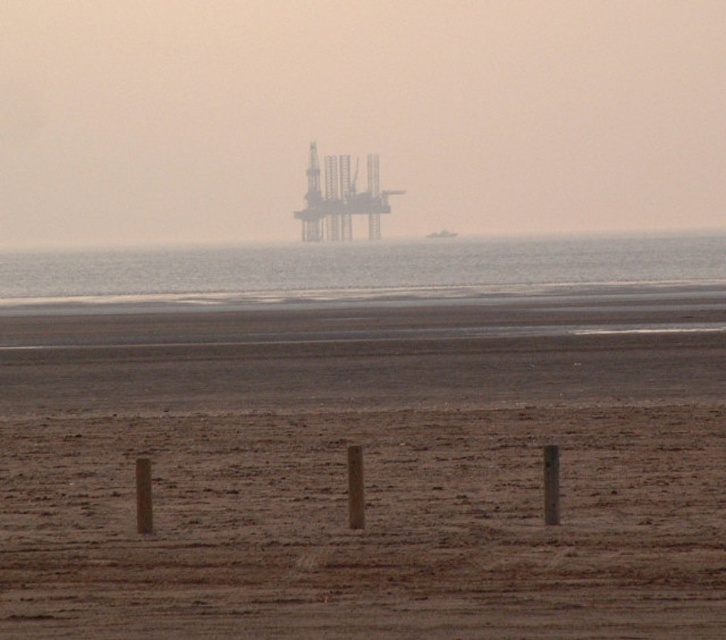
Question: Which of the following is the farthest from the observer?

Choices:
 (A) transparent water at center
 (B) brown sandy beach at lower center

Answer: (A)

Question: Can you confirm if brown sandy beach at lower center is bigger than transparent water at center?

Choices:
 (A) yes
 (B) no

Answer: (B)

Question: Among these objects, which one is farthest from the camera?

Choices:
 (A) transparent water at center
 (B) brown sandy beach at lower center

Answer: (A)

Question: Is brown sandy beach at lower center smaller than transparent water at center?

Choices:
 (A) yes
 (B) no

Answer: (A)

Question: Can you confirm if brown sandy beach at lower center is smaller than transparent water at center?

Choices:
 (A) no
 (B) yes

Answer: (B)